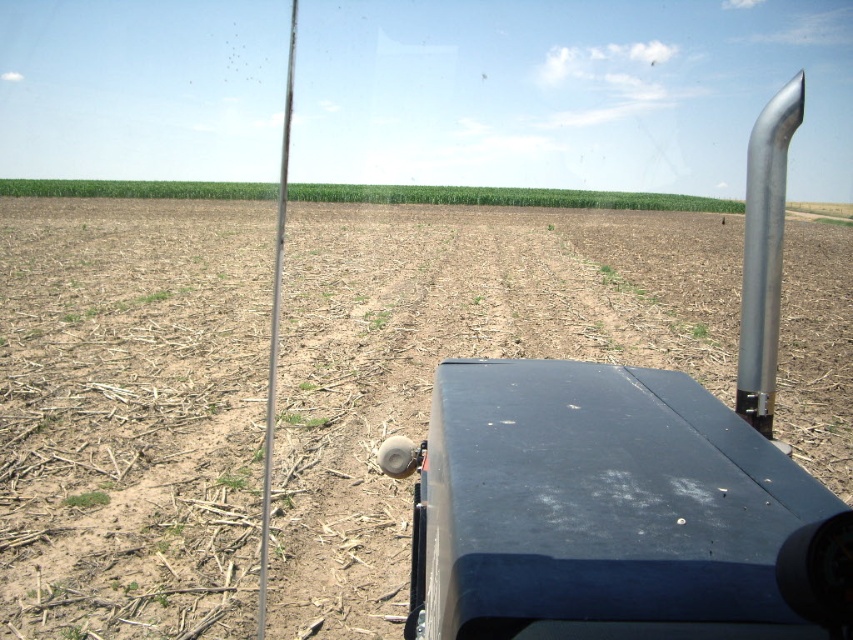
You are a farmer planning to plant new crops. You notice the brown dirt field at center. Based on its position, can you estimate how far it is from the tractor you are currently operating?

The brown dirt field at center is located at coordinates point (131,413), which suggests it is approximately 64.8 meters away from the tractor in the horizontal direction and 15.5 meters in the vertical direction, assuming the coordinate system is scaled to meters.

You are a farmer checking the height of your crops from inside your tractor. You notice the brown dirt field at center and the metallic exhaust pipe at center right. Which object is taller?

The brown dirt field at center is much taller than the metallic exhaust pipe at center right.

You are a farmer checking the field from your tractor. You notice the brown dirt field at center and the metallic exhaust pipe at center right. Which object takes up more space in your view?

The brown dirt field at center takes up more space in your view because it is bigger than the metallic exhaust pipe at center right.